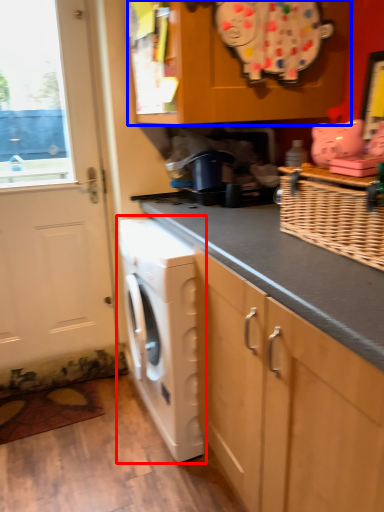
Question: Which object appears closest to the camera in this image, washing machine (highlighted by a red box) or cabinetry (highlighted by a blue box)?

Choices:
 (A) washing machine
 (B) cabinetry

Answer: (B)